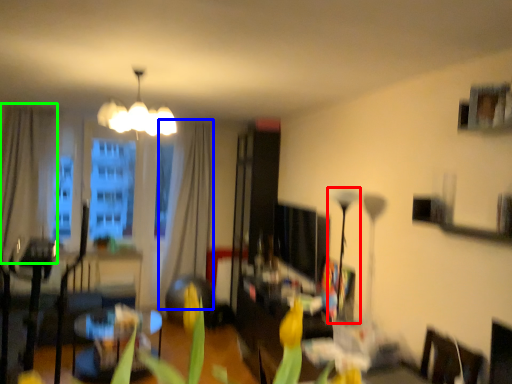
Question: Estimate the real-world distances between objects in this image. Which object is closer to lamp (highlighted by a red box), curtain (highlighted by a blue box) or curtain (highlighted by a green box)?

Choices:
 (A) curtain
 (B) curtain

Answer: (A)